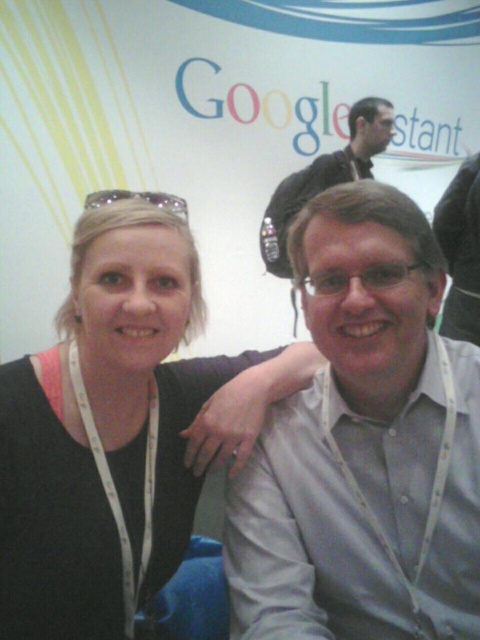
Question: Which point is closer to the camera?

Choices:
 (A) (372, 454)
 (B) (158, 250)
 (C) (383, 102)
 (D) (168, 204)

Answer: (A)

Question: Observing the image, what is the correct spatial positioning of gray shirt at center in reference to matte black shirt at upper center?

Choices:
 (A) left
 (B) right

Answer: (A)

Question: Is gray shirt at center smaller than black fabric at center?

Choices:
 (A) yes
 (B) no

Answer: (A)

Question: Considering the real-world distances, which object is closest to the matte black shirt at upper center?

Choices:
 (A) black fabric at center
 (B) metallic silver goggles at upper left
 (C) gray shirt at center

Answer: (B)

Question: Is gray shirt at center further to the viewer compared to metallic silver goggles at upper left?

Choices:
 (A) no
 (B) yes

Answer: (A)

Question: Estimate the real-world distances between objects in this image. Which object is farther from the black fabric at center?

Choices:
 (A) matte black shirt at upper center
 (B) gray shirt at center

Answer: (A)